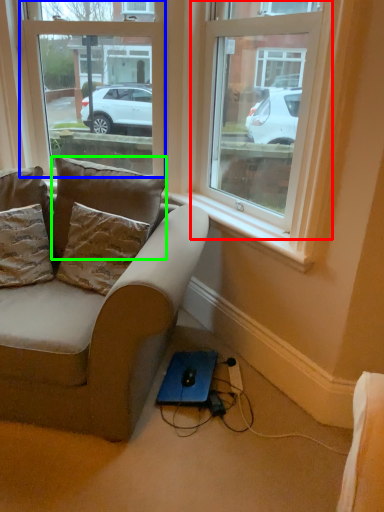
Question: Based on their relative distances, which object is farther from window (highlighted by a red box)? Choose from window (highlighted by a blue box) and pillow (highlighted by a green box).

Choices:
 (A) window
 (B) pillow

Answer: (A)